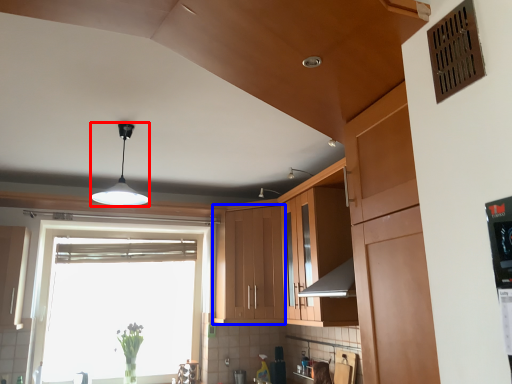
Question: Which of the following is the closest to the observer, light fixture (highlighted by a red box) or cabinetry (highlighted by a blue box)?

Choices:
 (A) light fixture
 (B) cabinetry

Answer: (A)